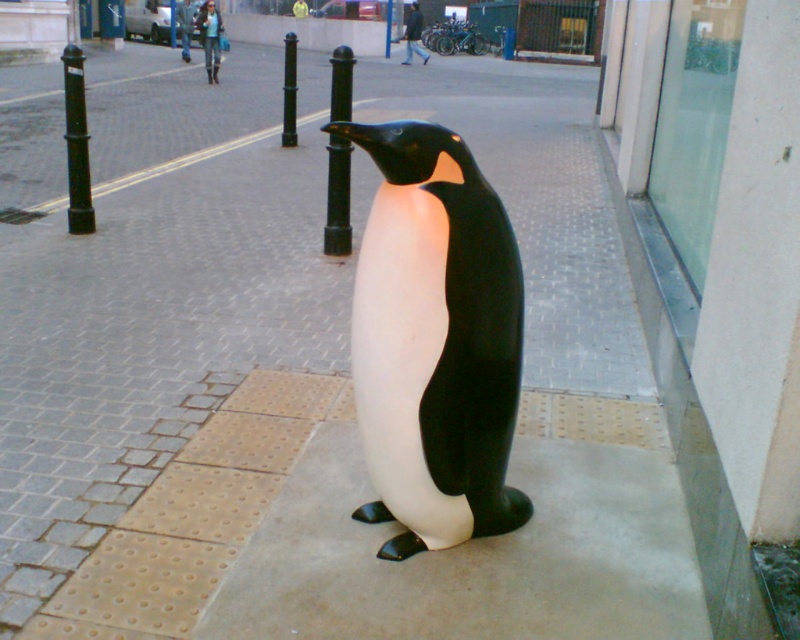
You are a city planner evaluating the sidewalk layout. The black metal pole at center and the black glossy pole at center are both in the same location. Which pole would cast a longer shadow during midday?

The black metal pole at center is much taller than the black glossy pole at center, so it would cast a longer shadow during midday.

You are standing in front of the penguin statue on the sidewalk. There are two points marked on the ground in front of you at coordinates point (338, 145) and point (290, 74). If you want to place a small flowerpot between them, which point should you start from to ensure the flowerpot is closer to the penguin statue?

You should start from point (338, 145) because it is closer to the viewer than point (290, 74). Since the penguin statue is near the edge of the sidewalk, placing the flowerpot closer to the viewer would position it nearer to the statue.